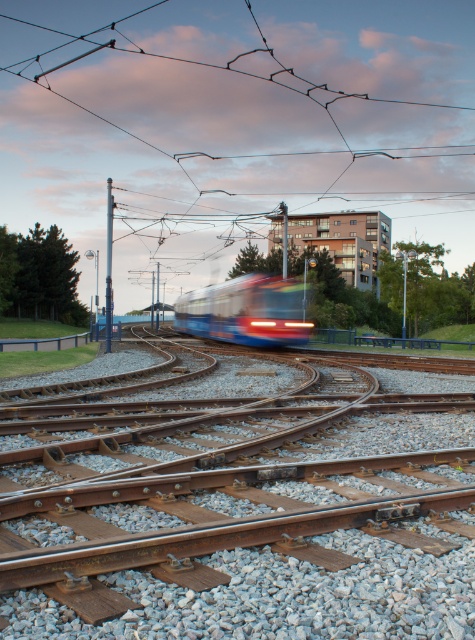
Looking at this image, you are a tram conductor who needs to align the brown wooden track at center with the blue glossy tram at center for a smooth transition. Which direction should you move the track to align it properly?

The brown wooden track at center is currently to the right of the blue glossy tram at center. To align them properly, you should move the brown wooden track at center to the left so that it is positioned directly under the blue glossy tram at center.

You are a tram operator who needs to ensure the blue glossy tram at center can safely pass over the brown wooden track at center. Based on the scene description, is there any concern regarding the size compatibility between the two?

The brown wooden track at center has a smaller size compared to the blue glossy tram at center, which may pose a risk as the track might not be able to support the tram safely.